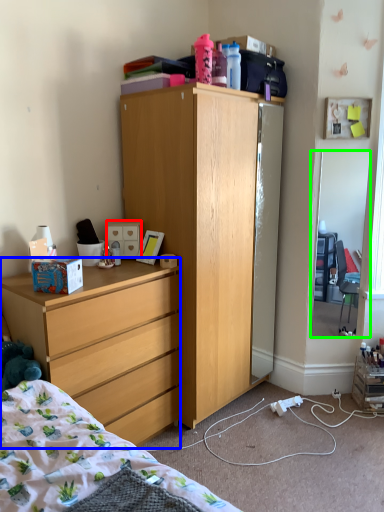
Question: Estimate the real-world distances between objects in this image. Which object is farther from drawer (highlighted by a red box), desk (highlighted by a blue box) or mirror (highlighted by a green box)?

Choices:
 (A) desk
 (B) mirror

Answer: (B)